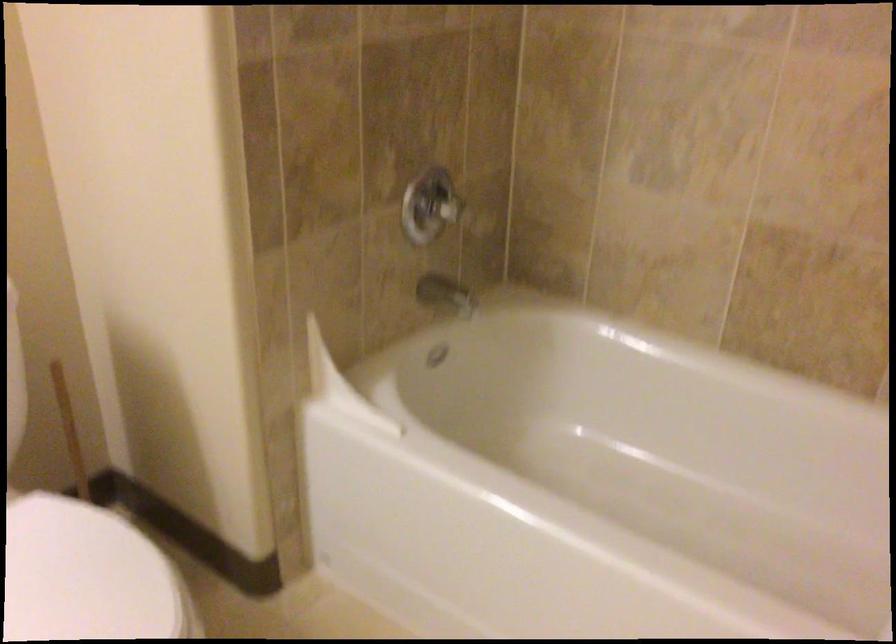
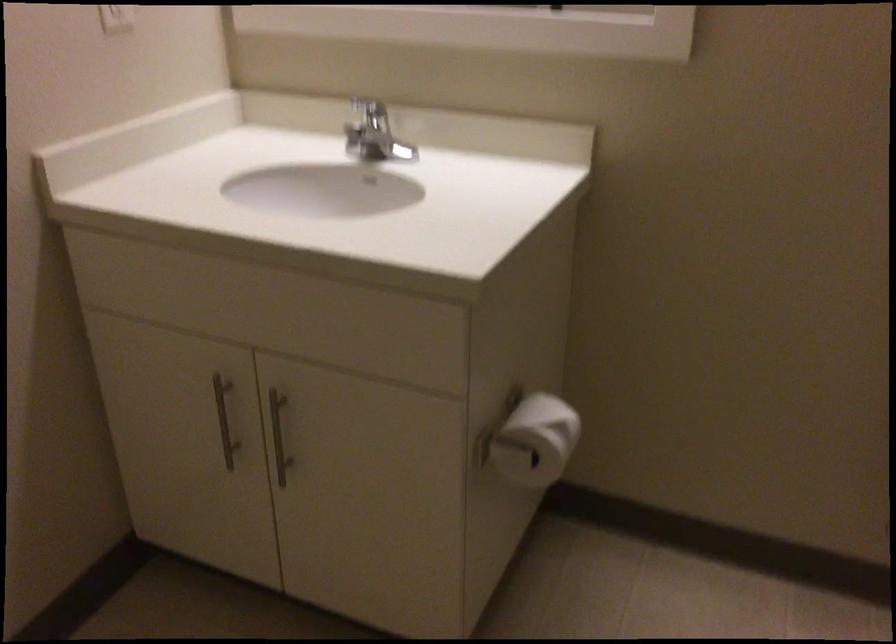
The first image is from the beginning of the video and the second image is from the end. How did the camera likely rotate when shooting the video?

The rotation direction of the camera is left-down.